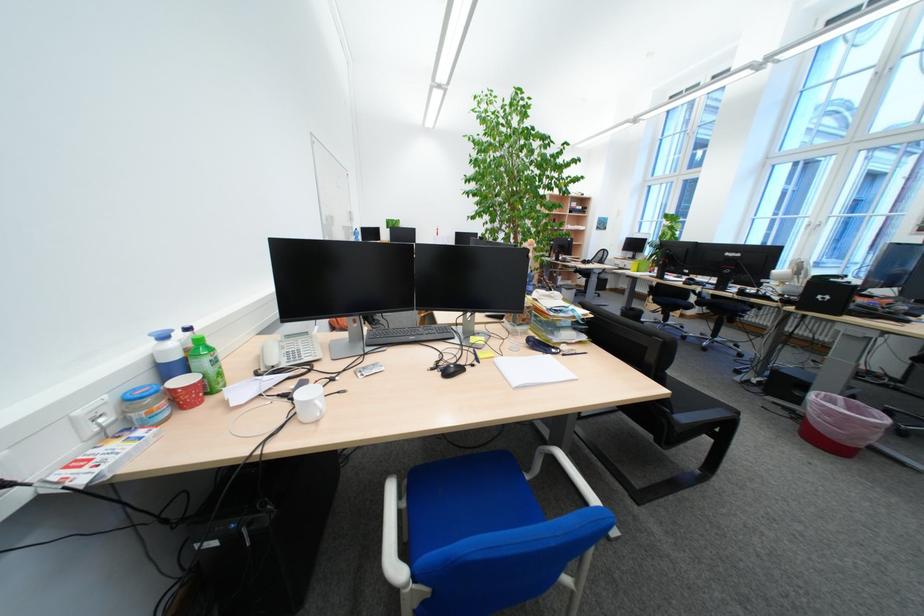
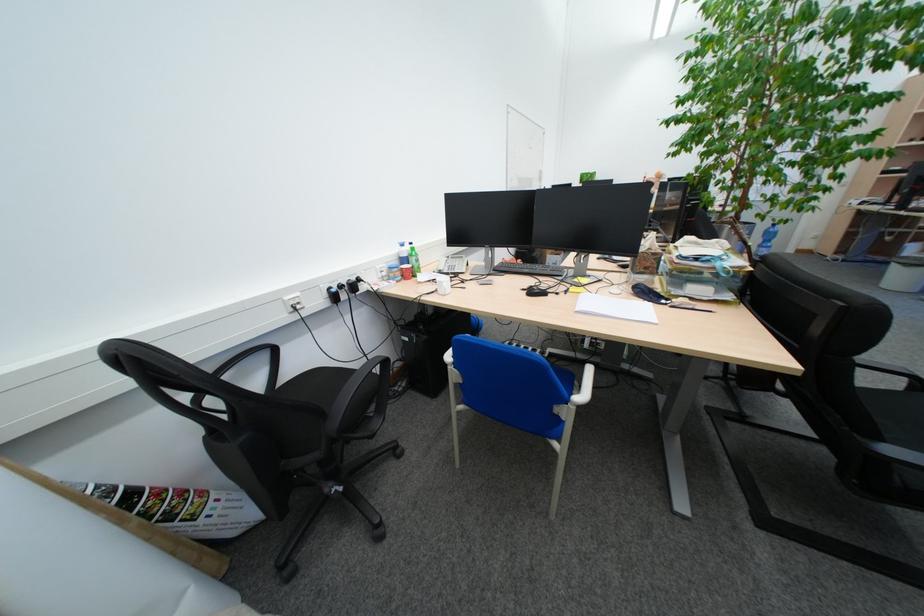
Question: The camera is either moving clockwise (left) or counter-clockwise (right) around the object. The first image is from the beginning of the video and the second image is from the end. Is the camera moving left or right when shooting the video?

Choices:
 (A) Left
 (B) Right

Answer: (B)